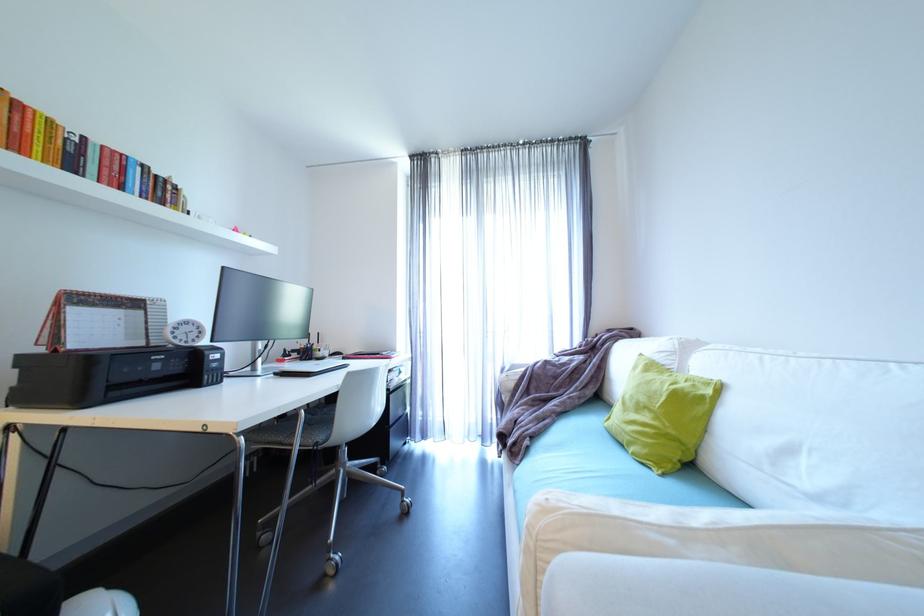
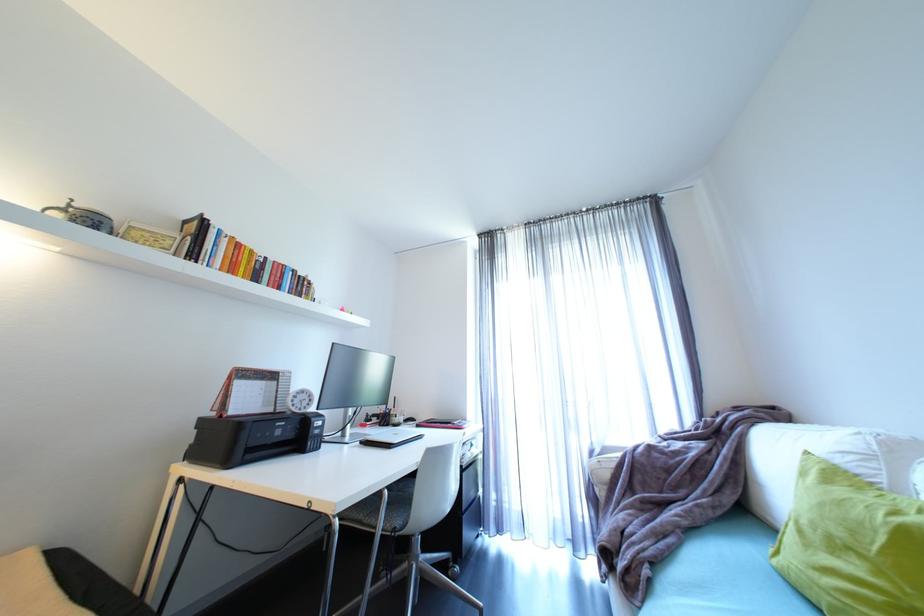
The point at (64, 351) is marked in the first image. Where is the corresponding point in the second image?

(228, 416)